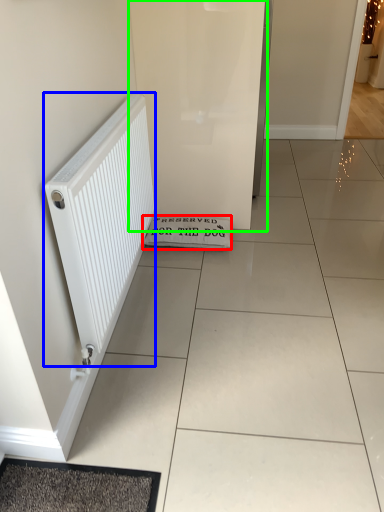
Question: Which object is positioned closest to doormat (highlighted by a red box)? Select from radiator (highlighted by a blue box) and screen door (highlighted by a green box).

Choices:
 (A) radiator
 (B) screen door

Answer: (B)